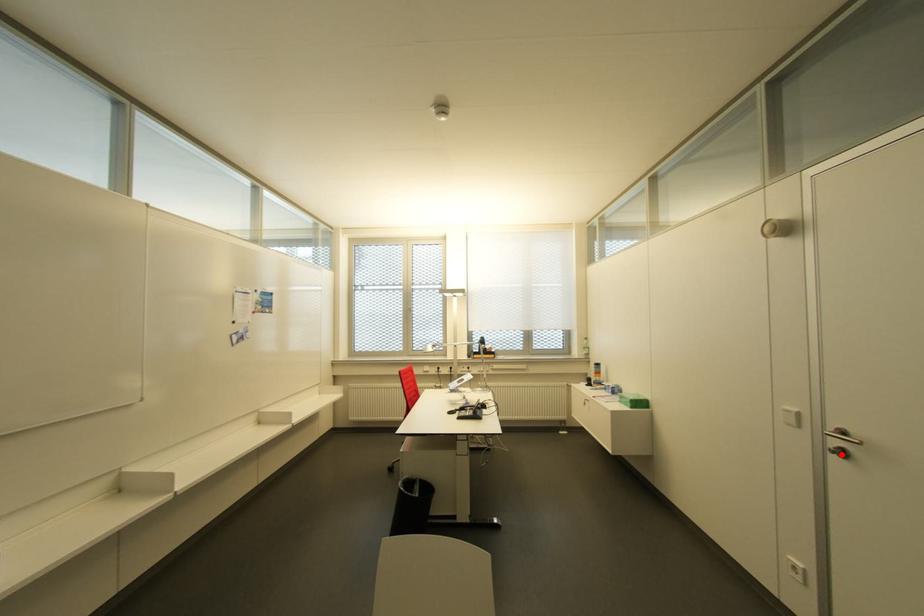
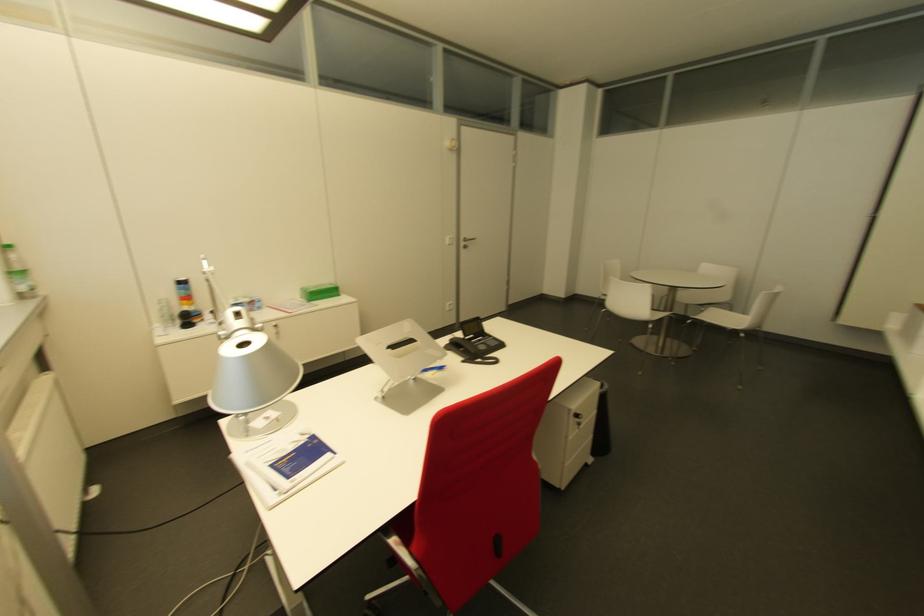
Question: I am providing you with two images of the same scene from different viewpoints. In image1, a red point is highlighted. Considering the same 3D point in image2, which of the following is correct?

Choices:
 (A) It is closer
 (B) It is farther

Answer: (A)